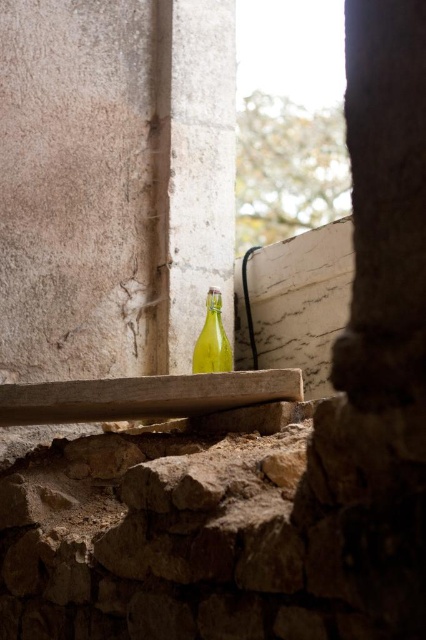
Question: Can you confirm if smooth wooden plank at center is thinner than green glass bottle at center?

Choices:
 (A) no
 (B) yes

Answer: (A)

Question: In this image, where is smooth wooden plank at center located relative to green glass bottle at center?

Choices:
 (A) above
 (B) below

Answer: (B)

Question: Which of the following is the farthest from the observer?

Choices:
 (A) smooth wooden plank at center
 (B) green glass bottle at center

Answer: (B)

Question: Which object appears closest to the camera in this image?

Choices:
 (A) smooth wooden plank at center
 (B) green glass bottle at center

Answer: (A)

Question: Can you confirm if smooth wooden plank at center is positioned to the right of green glass bottle at center?

Choices:
 (A) no
 (B) yes

Answer: (A)